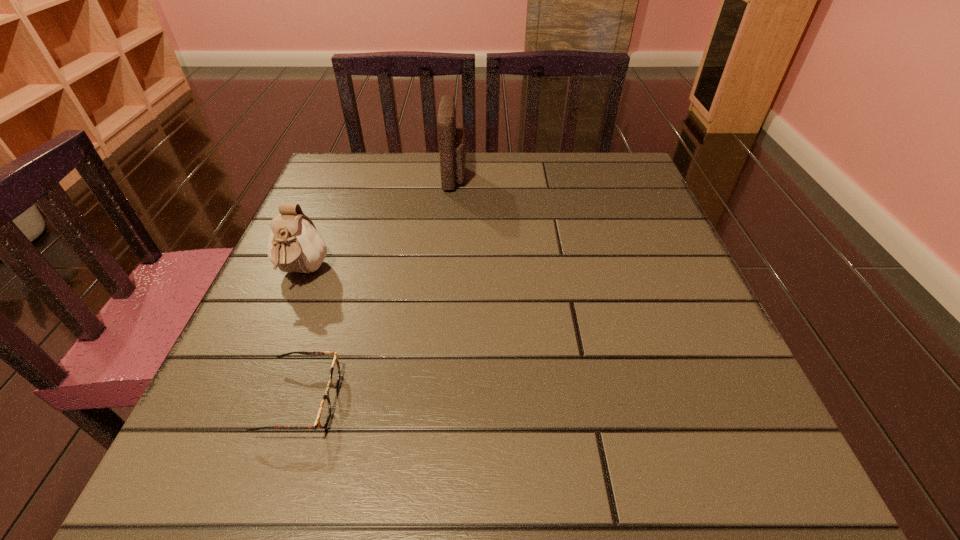
I want to click on object that stands as the second closest to the second tallest object, so click(452, 141).

At what (x,y) coordinates should I click in order to perform the action: click on the closest object relative to the farther pouch. Please return your answer as a coordinate pair (x, y). Image resolution: width=960 pixels, height=540 pixels. Looking at the image, I should click on (294, 245).

Locate an element on the screen. vacant space that satisfies the following two spatial constraints: 1. with an open flap on the farther pouch; 2. on the front-facing side of the nearer pouch is located at coordinates (448, 272).